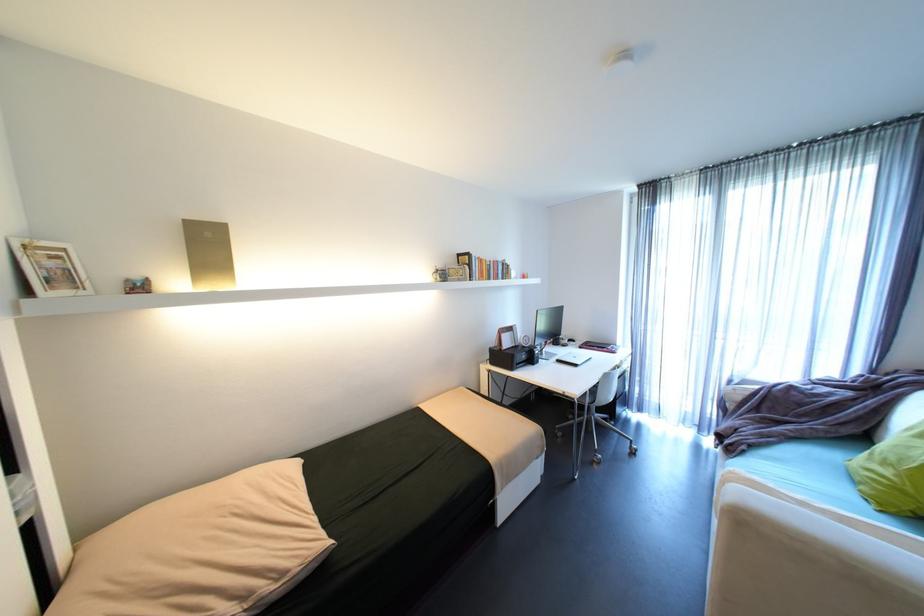
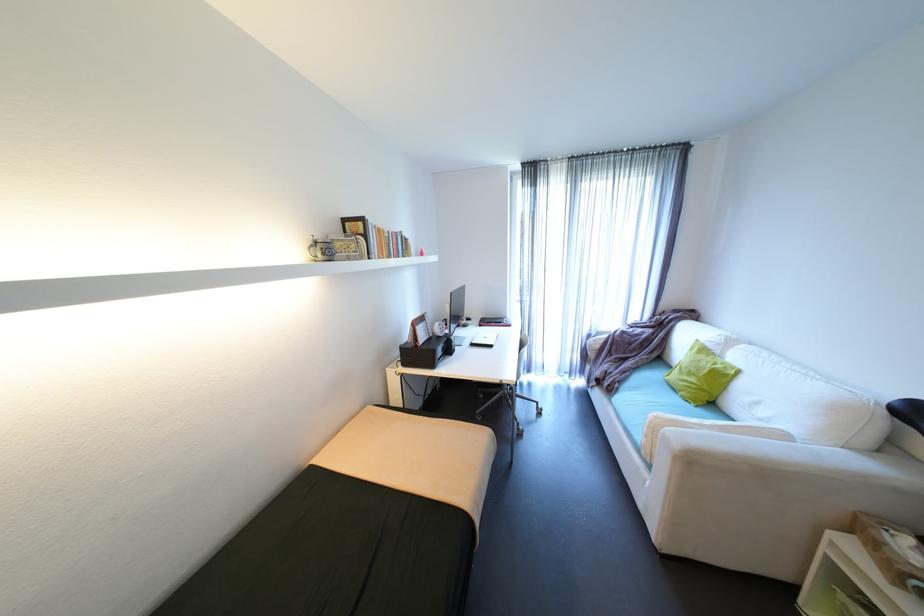
Find the pixel in the second image that matches the point at 612,347 in the first image.

(508, 323)